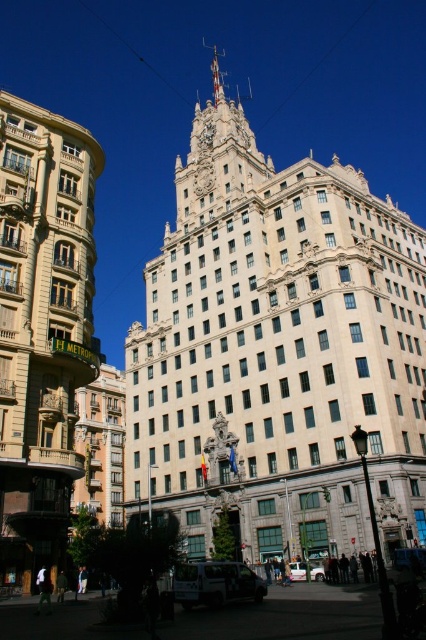
Question: From the image, what is the correct spatial relationship of white stone building at center in relation to brown textured building at left?

Choices:
 (A) below
 (B) above

Answer: (B)

Question: Observing the image, what is the correct spatial positioning of white stone building at center in reference to brown textured building at left?

Choices:
 (A) right
 (B) left

Answer: (A)

Question: Does white stone building at center have a larger size compared to brown textured building at left?

Choices:
 (A) yes
 (B) no

Answer: (A)

Question: Which of the following is the closest to the observer?

Choices:
 (A) (317, 394)
 (B) (14, 566)

Answer: (B)